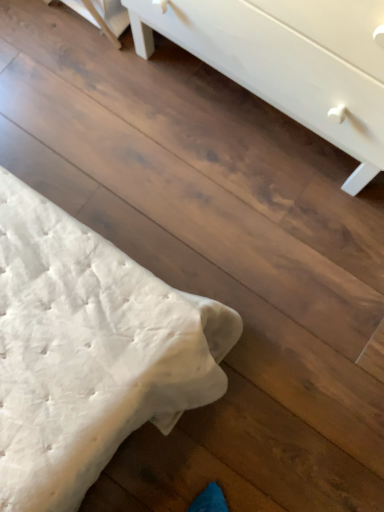
The image size is (384, 512). What do you see at coordinates (289, 62) in the screenshot?
I see `white matte chest of drawers at upper right` at bounding box center [289, 62].

Find the location of a particular element. This screenshot has width=384, height=512. white matte chest of drawers at upper right is located at coordinates (289, 62).

Find the location of a particular element. The image size is (384, 512). white matte chest of drawers at upper right is located at coordinates 289,62.